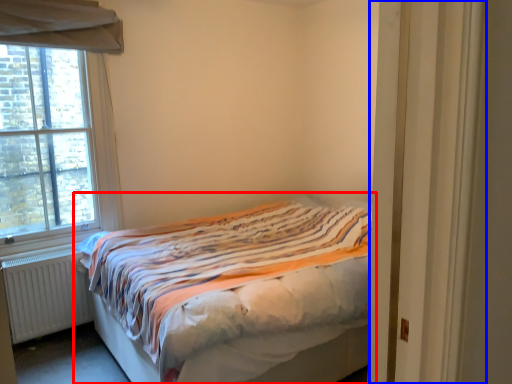
Question: Which of the following is the closest to the observer, bed (highlighted by a red box) or door (highlighted by a blue box)?

Choices:
 (A) bed
 (B) door

Answer: (B)